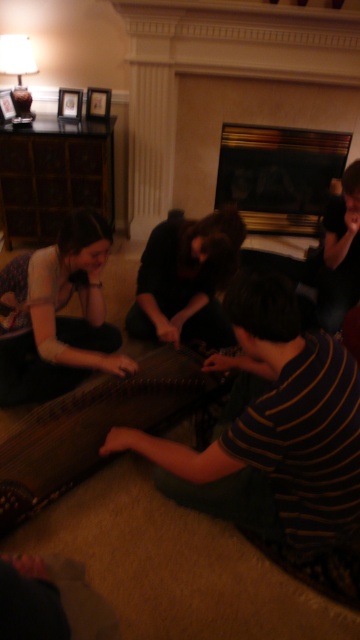
Question: Does matte black dress at lower left have a lesser width compared to black glass fireplace at upper center?

Choices:
 (A) yes
 (B) no

Answer: (A)

Question: Is matte black dress at lower left to the right of black glass fireplace at upper center from the viewer's perspective?

Choices:
 (A) no
 (B) yes

Answer: (A)

Question: Is matte black dress at lower left further to the viewer compared to black glass fireplace at upper center?

Choices:
 (A) yes
 (B) no

Answer: (B)

Question: Which is farther from the dark brown leather jacket at upper right?

Choices:
 (A) wooden harp at center
 (B) black glass fireplace at upper center
 (C) dark brown leather guitar at center

Answer: (B)

Question: Based on their relative distances, which object is farther from the dark brown leather guitar at center?

Choices:
 (A) wooden harp at center
 (B) dark brown leather jacket at upper right
 (C) black glass fireplace at upper center
 (D) matte black dress at lower left

Answer: (C)

Question: Which point is farther from the camera taking this photo?

Choices:
 (A) (262, 161)
 (B) (216, 304)
 (C) (273, 374)
 (D) (322, 248)

Answer: (A)